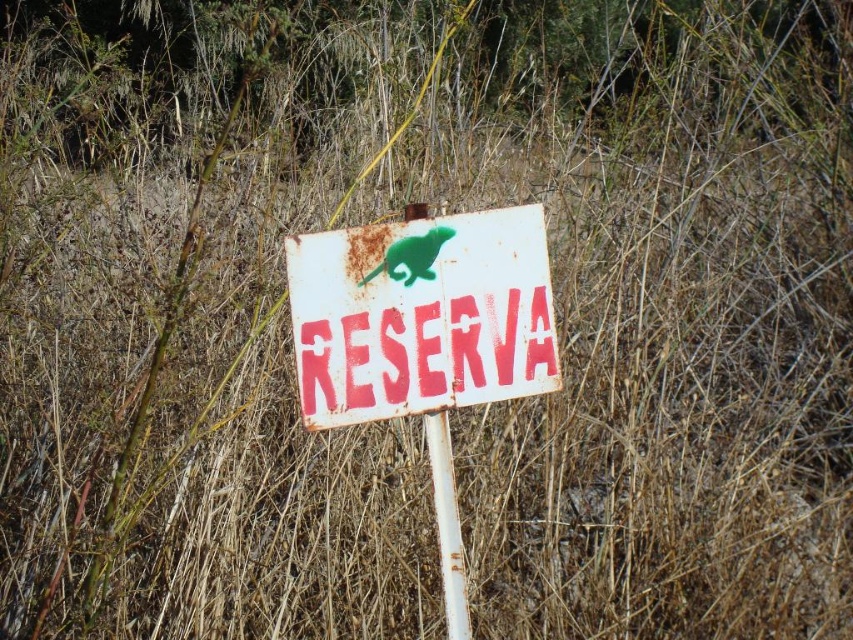
You are a hiker who wants to take a photo of the rusty metal sign at center and the rusty metal pole at center. Which object should you focus on if you want to capture both in the frame without zooming in or out?

The rusty metal sign at center is bigger than the rusty metal pole at center, so you should focus on the rusty metal sign at center to ensure both are visible without zooming.

You are a hiker who just arrived at the signpost. You need to report the exact position of the rusty metal sign at center and the rusty metal pole at center relative to each other. Which one is positioned to the left?

The rusty metal sign at center is positioned to the left of the rusty metal pole at center.